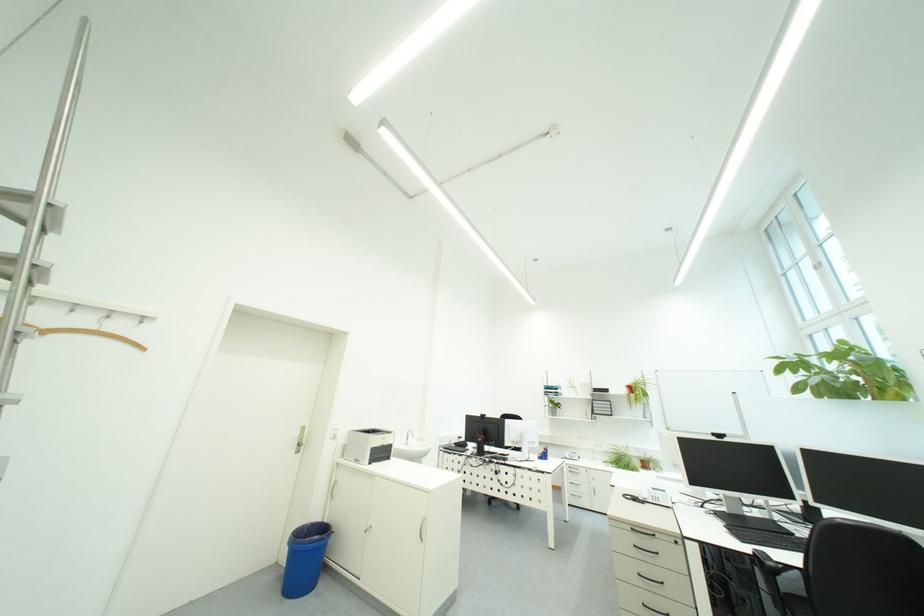
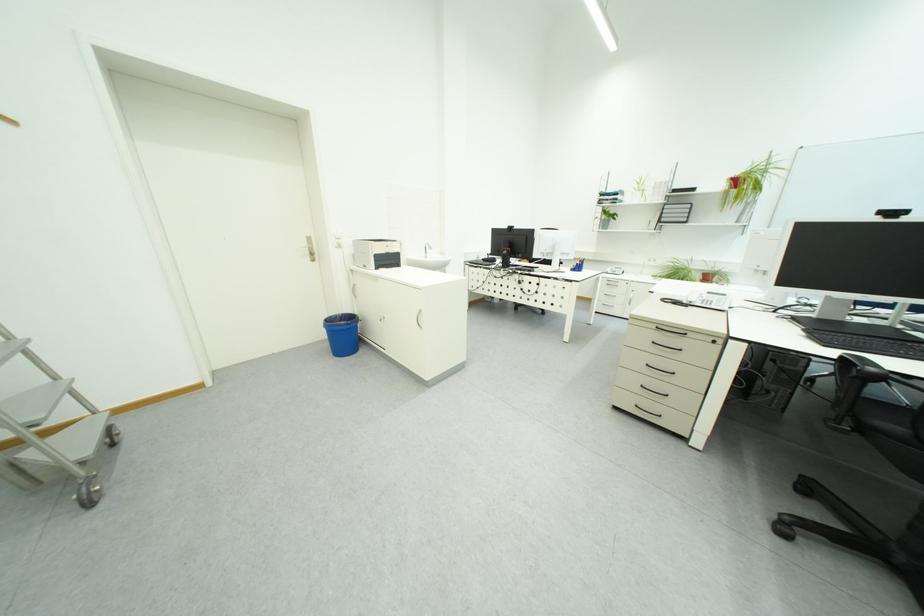
Locate, in the second image, the point that corresponds to the point at 640,384 in the first image.

(748, 175)